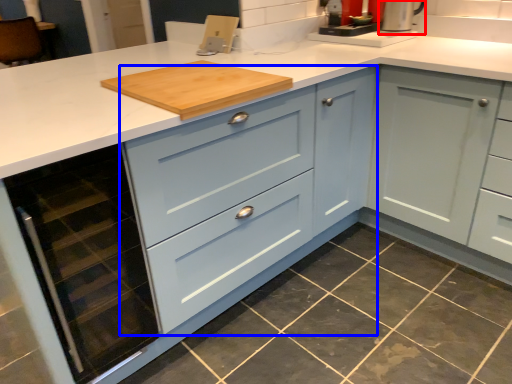
Question: Which point is further to the camera, appliance (highlighted by a red box) or cabinetry (highlighted by a blue box)?

Choices:
 (A) appliance
 (B) cabinetry

Answer: (A)